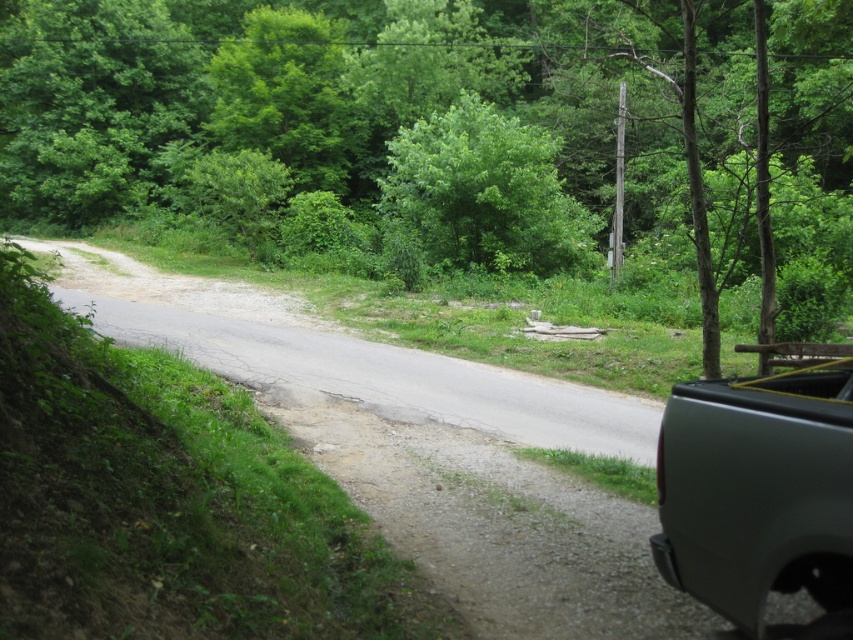
Question: Does satin gray truck at right have a smaller size compared to green leafy tree at center?

Choices:
 (A) yes
 (B) no

Answer: (A)

Question: Which point is closer to the camera taking this photo?

Choices:
 (A) (723, 440)
 (B) (851, 33)
 (C) (798, 218)
 (D) (440, 196)

Answer: (A)

Question: Which of the following is the farthest from the observer?

Choices:
 (A) satin gray truck at right
 (B) gray matte truck at right
 (C) green leafy tree at center
 (D) green leafy tree at upper center

Answer: (C)

Question: Does green leafy tree at upper center have a greater width compared to green leafy tree at center?

Choices:
 (A) no
 (B) yes

Answer: (B)

Question: Is green leafy tree at upper center above satin gray truck at right?

Choices:
 (A) yes
 (B) no

Answer: (A)

Question: Which point is closer to the camera taking this photo?

Choices:
 (A) (15, 61)
 (B) (430, 172)
 (C) (700, 509)
 (D) (601, 205)

Answer: (C)